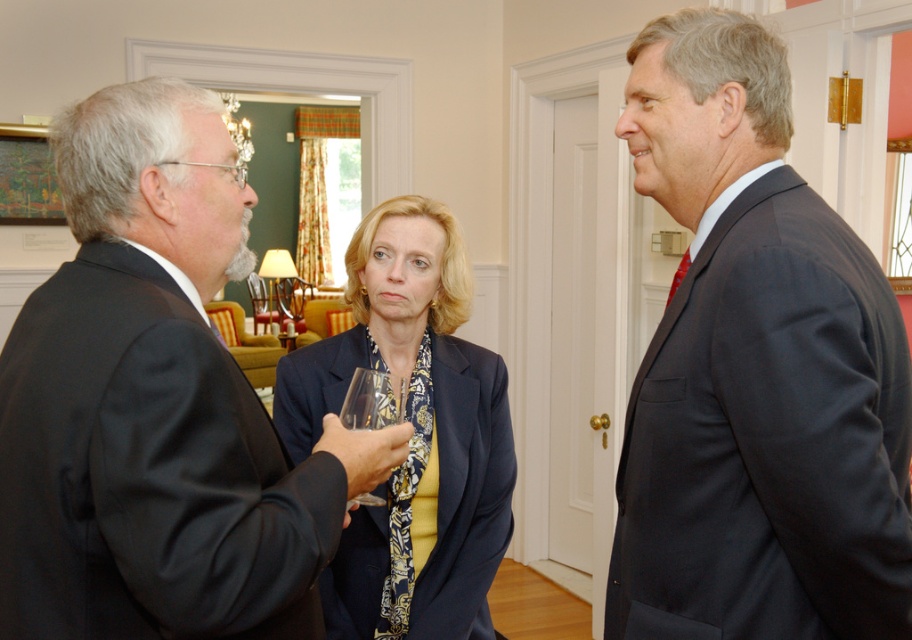
You are a photographer at a formal event. You want to take a group photo of the black matte suit at left and the matte blue blazer at center. The camera you are using has a minimum focus distance of 60 centimeters. Will you be able to capture both subjects clearly in the photo without moving them?

The black matte suit at left and matte blue blazer at center are 70.74 centimeters apart. Since the distance between them is greater than the camera minimum focus distance of 60 centimeters, you can capture both subjects clearly without moving them.

You are a photographer at the event and need to capture a clear photo of the black matte suit at left and the transparent glass at center. Which object might be more challenging to photograph due to its reflective surface?

The transparent glass at center might be more challenging to photograph due to its reflective surface, as it can cause glare or reflections in the image.